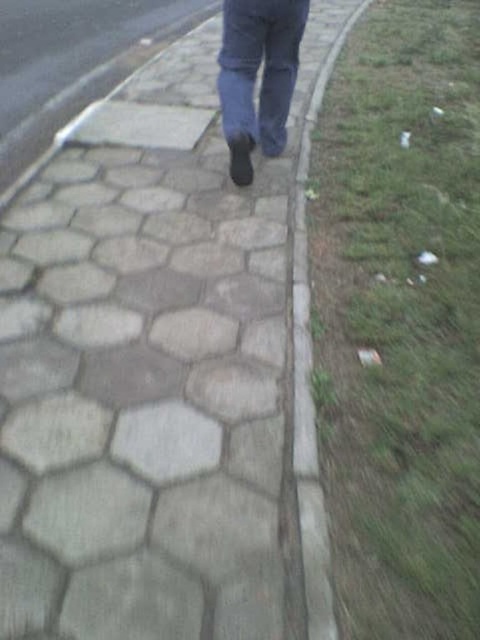
Who is positioned more to the left, gray concrete curb at center or denim at center?

Positioned to the left is denim at center.

Is gray concrete curb at center above denim at center?

No.

Is point (301, 536) closer to viewer compared to point (274, 8)?

Yes, point (301, 536) is in front of point (274, 8).

In order to click on gray concrete curb at center in this screenshot , I will do `click(310, 385)`.